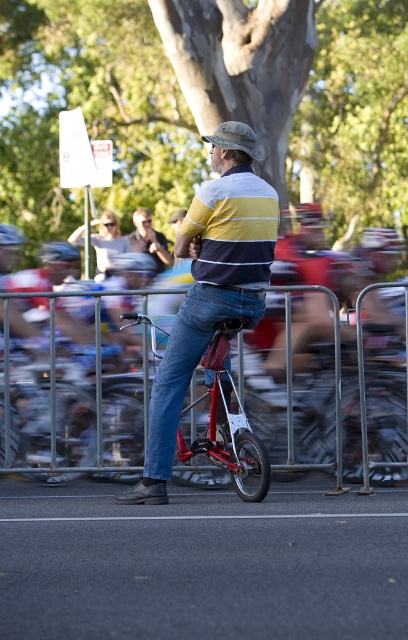
You are a photographer at the cycling event. You have a matte black camera at center and a matte black sunglasses at upper center. Which object is positioned higher in your view?

The matte black sunglasses at upper center is positioned higher than the matte black camera at center.

You are a photographer at the cycling event. You have a matte black camera at center and need to place it on a metallic silver fence at center. Can the camera fit on the fence without exceeding its edges?

The metallic silver fence at center is larger in size than the matte black camera at center, so the camera can fit on the fence without exceeding its edges.

You are a photographer positioned at the camera. You want to capture a closeup shot of the matte black sunglasses at upper center. Can you adjust your position to get a closer shot without moving more than 10 meters?

The matte black sunglasses at upper center and camera are 11.55 meters apart from each other. Since moving 10 meters is less than the required distance of 11.55 meters, you cannot get close enough without moving more than 10 meters.